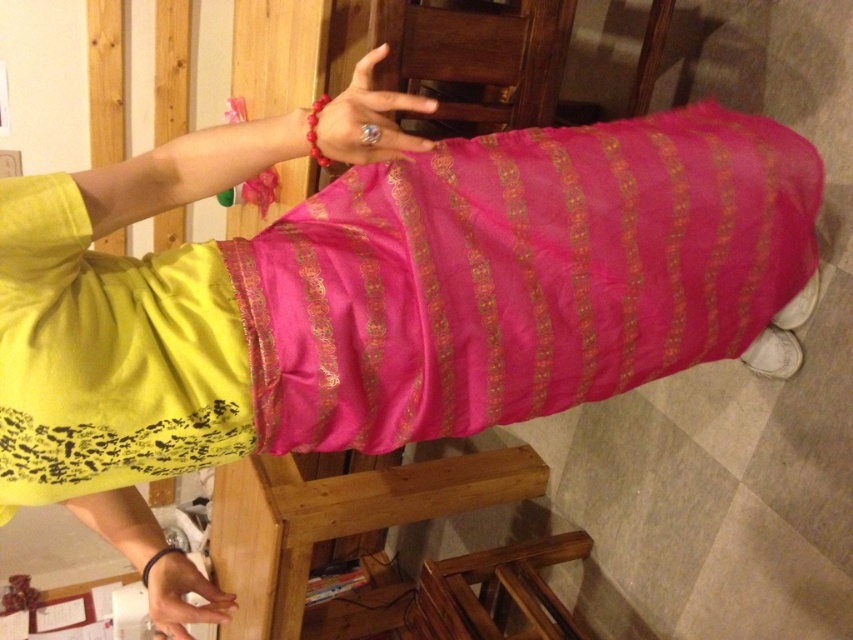
Question: Can you confirm if shiny silk dress at center is thinner than matte gold ring at upper center?

Choices:
 (A) yes
 (B) no

Answer: (B)

Question: Based on their relative distances, which object is nearer to the shiny silk dress at center?

Choices:
 (A) matte gold ring at upper center
 (B) matte pink fabric at lower center

Answer: (A)

Question: Estimate the real-world distances between objects in this image. Which object is farther from the shiny silk dress at center?

Choices:
 (A) matte pink fabric at lower center
 (B) matte gold ring at upper center

Answer: (A)

Question: Which point is farther from the camera taking this photo?

Choices:
 (A) pyautogui.click(x=161, y=609)
 (B) pyautogui.click(x=364, y=157)
 (C) pyautogui.click(x=135, y=461)

Answer: (A)

Question: Is the position of shiny silk dress at center more distant than that of matte pink fabric at lower center?

Choices:
 (A) yes
 (B) no

Answer: (B)

Question: Is shiny silk dress at center closer to the viewer compared to matte pink fabric at lower center?

Choices:
 (A) no
 (B) yes

Answer: (B)